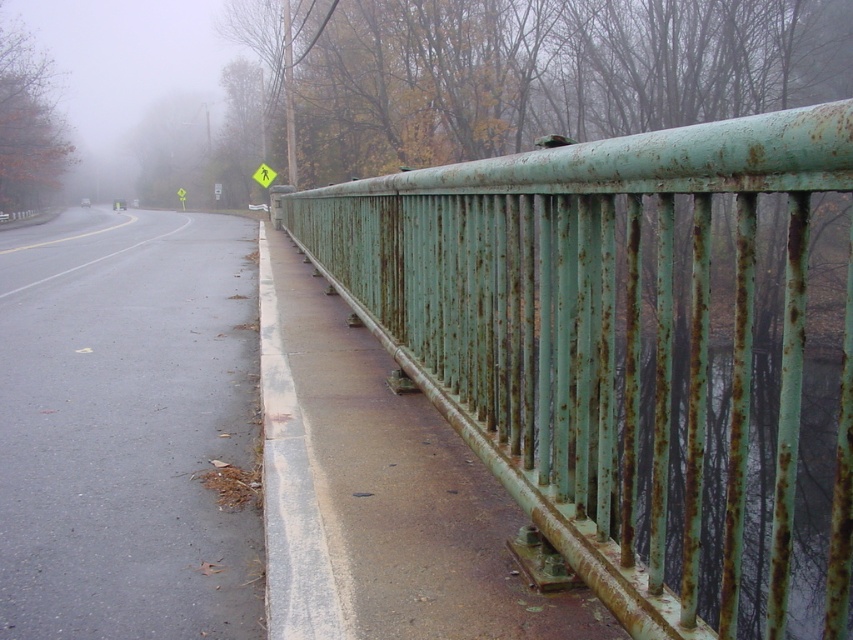
This screenshot has width=853, height=640. I want to click on rusty green metal fence at right, so click(637, 353).

Is rusty green metal fence at right closer to the viewer compared to yellow paper pedestrian at upper center?

Yes, it is in front of yellow paper pedestrian at upper center.

At what (x,y) coordinates should I click in order to perform the action: click on rusty green metal fence at right. Please return your answer as a coordinate pair (x, y). The width and height of the screenshot is (853, 640). Looking at the image, I should click on (637, 353).

Image resolution: width=853 pixels, height=640 pixels. What are the coordinates of `rusty green metal fence at right` in the screenshot? It's located at (637, 353).